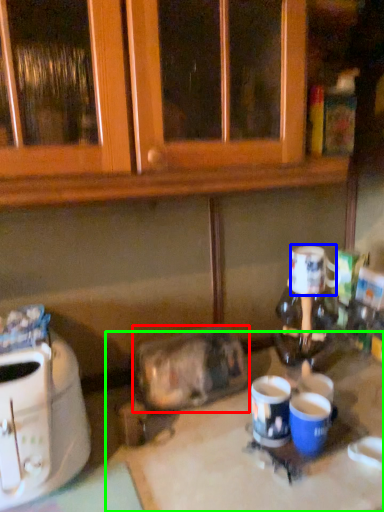
Question: Estimate the real-world distances between objects in this image. Which object is farther from appliance (highlighted by a red box), coffee cup (highlighted by a blue box) or table (highlighted by a green box)?

Choices:
 (A) coffee cup
 (B) table

Answer: (A)